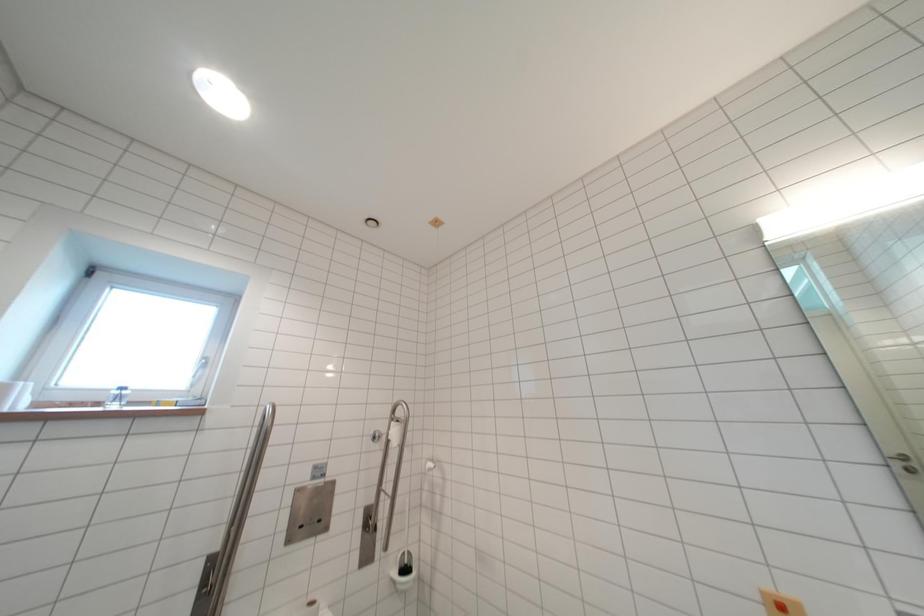
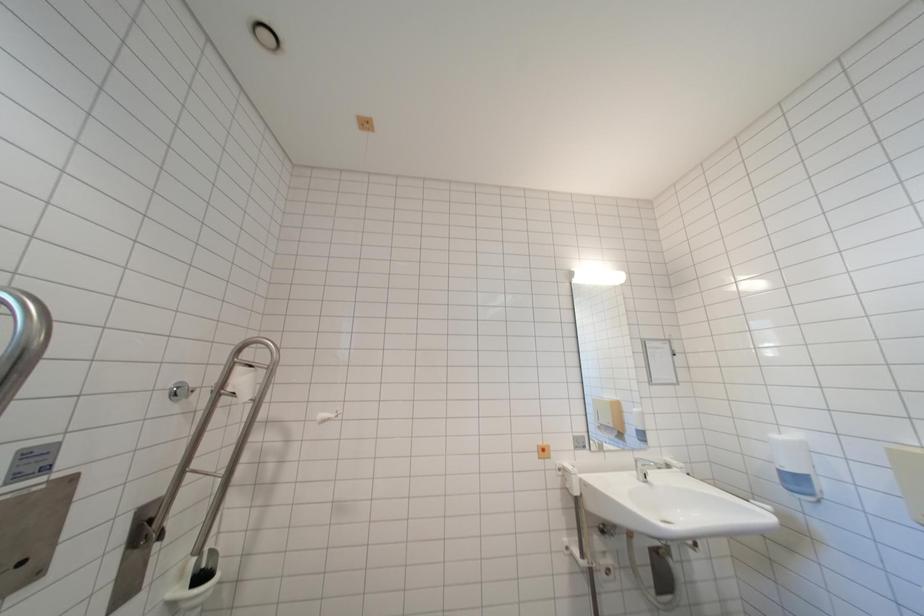
Question: The images are taken continuously from a first-person perspective. In which direction is your viewpoint rotating?

Choices:
 (A) Left
 (B) Right
 (C) Up
 (D) Down

Answer: (B)